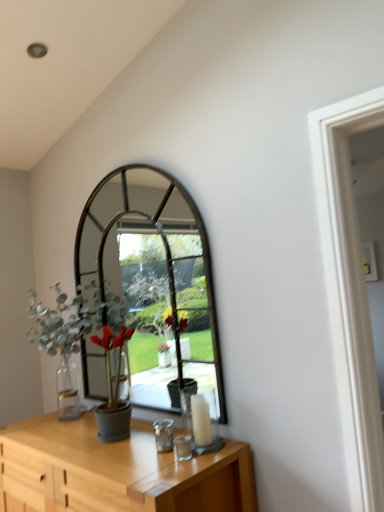
The image size is (384, 512). In order to click on vacant space in front of white glass candle at center in this screenshot , I will do `click(209, 458)`.